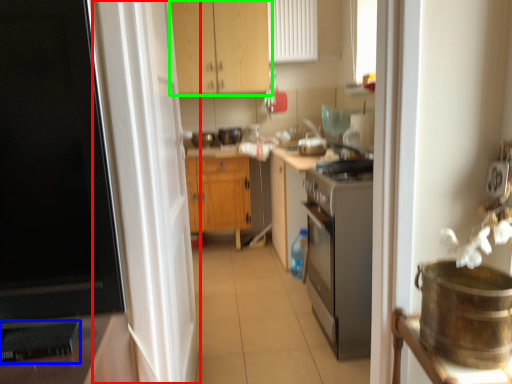
Question: Which object is the farthest from screen door (highlighted by a red box)? Choose among these: appliance (highlighted by a blue box) or cabinetry (highlighted by a green box).

Choices:
 (A) appliance
 (B) cabinetry

Answer: (B)